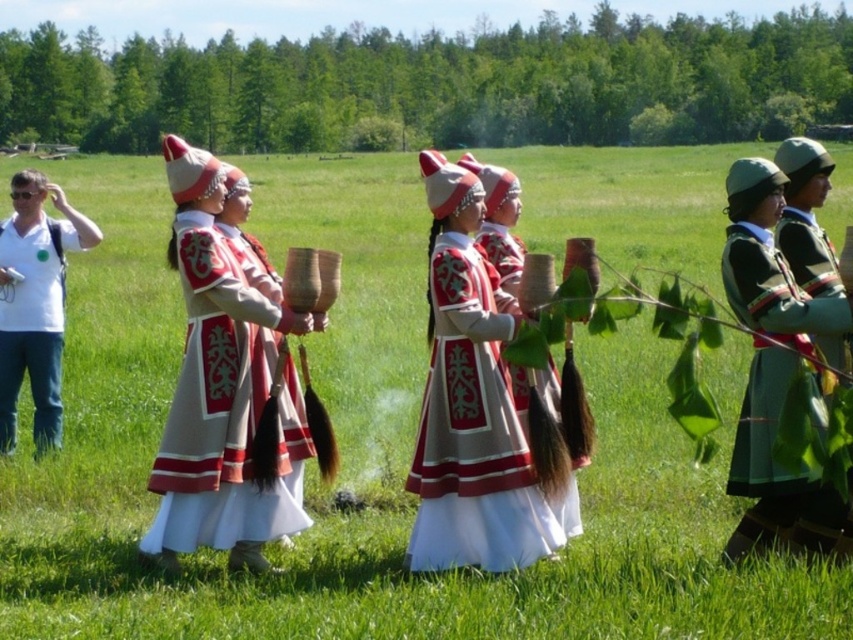
You are a photographer planning to take a group photo of the scene described. You want to ensure that both the green woolen jacket at right and the embroidered silk dress at center are clearly visible in the photo. Given their height difference, where should you position yourself to capture both effectively?

The green woolen jacket at right is much taller than the embroidered silk dress at center. To ensure both are visible, position yourself at a slight angle or higher elevation so the shorter embroidered silk dress at center isn t obscured by the taller green woolen jacket at right.

You are a photographer positioned in front of the scene. You need to capture a photo where both the embroidered cotton dress at center and the green matte jacket at right are visible. Based on their positions, which object should you focus on first to ensure both are in frame?

The embroidered cotton dress at center is to the left of green matte jacket at right, so you should focus on the embroidered cotton dress at center first to ensure both are in frame.

You are a photographer setting up a tripod to capture the scene. You need to ensure that both the embroidered cotton dress at center and the green matte jacket at right are fully visible in the frame. Given their widths, which object requires a wider angle to accommodate its size?

The embroidered cotton dress at center requires a wider angle because its width surpasses that of the green matte jacket at right, necessitating more space in the frame to fully capture it.